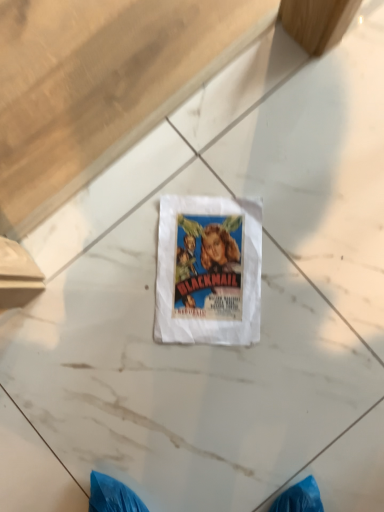
At what (x,y) coordinates should I click in order to perform the action: click on vacant space behind colorful paper poster at center. Please return your answer as a coordinate pair (x, y). This screenshot has width=384, height=512. Looking at the image, I should click on (178, 168).